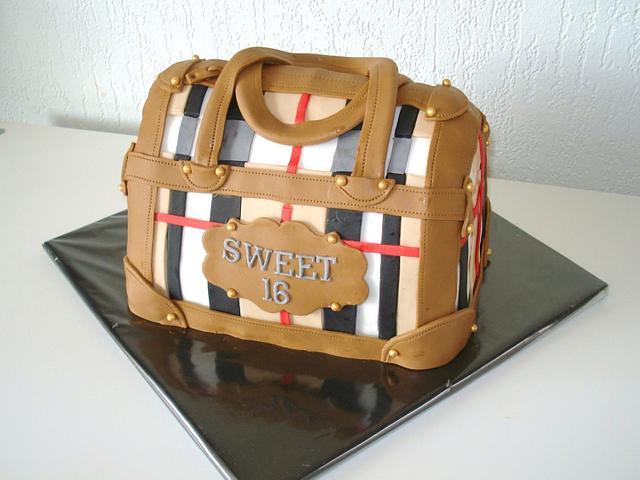
Locate an element on the screen. The image size is (640, 480). empty space on table is located at coordinates (68, 402).